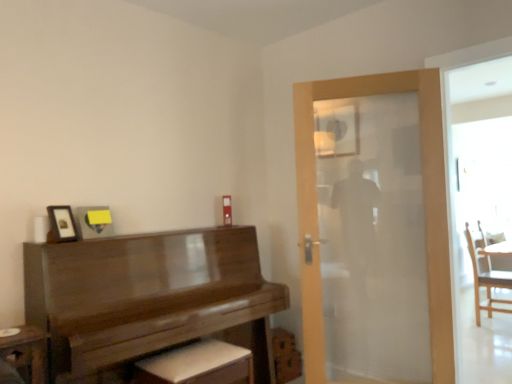
This screenshot has width=512, height=384. Find the location of `empty space that is ontop of white leather footrest at lower center (from a real-world perspective)`. empty space that is ontop of white leather footrest at lower center (from a real-world perspective) is located at coordinates (190, 350).